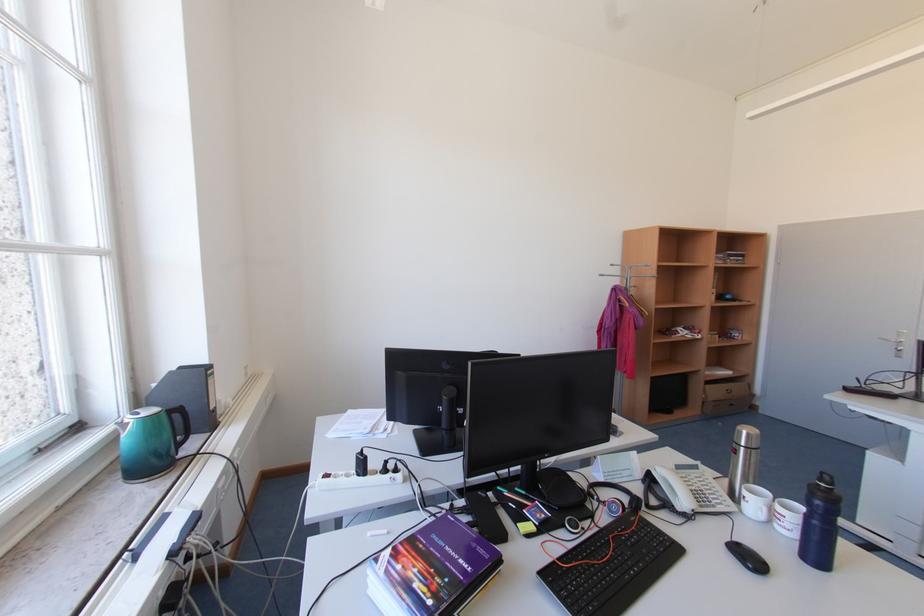
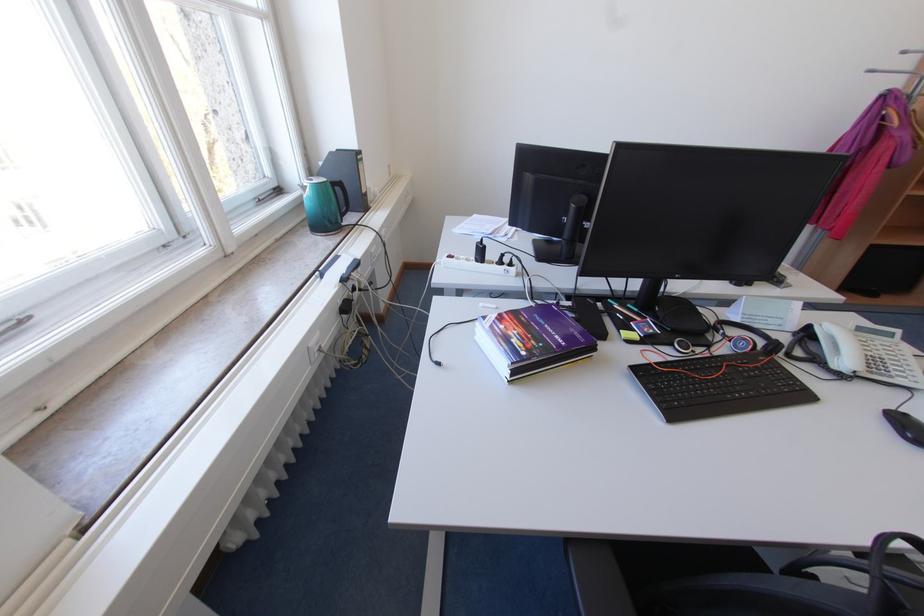
The images are taken continuously from a first-person perspective. In which direction is your viewpoint rotating?

The camera rotated toward left-down.